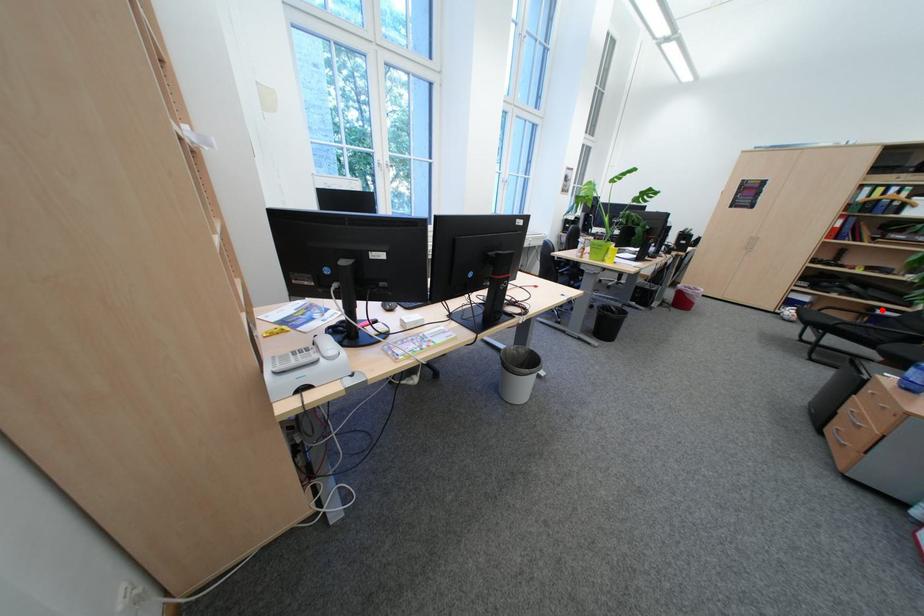
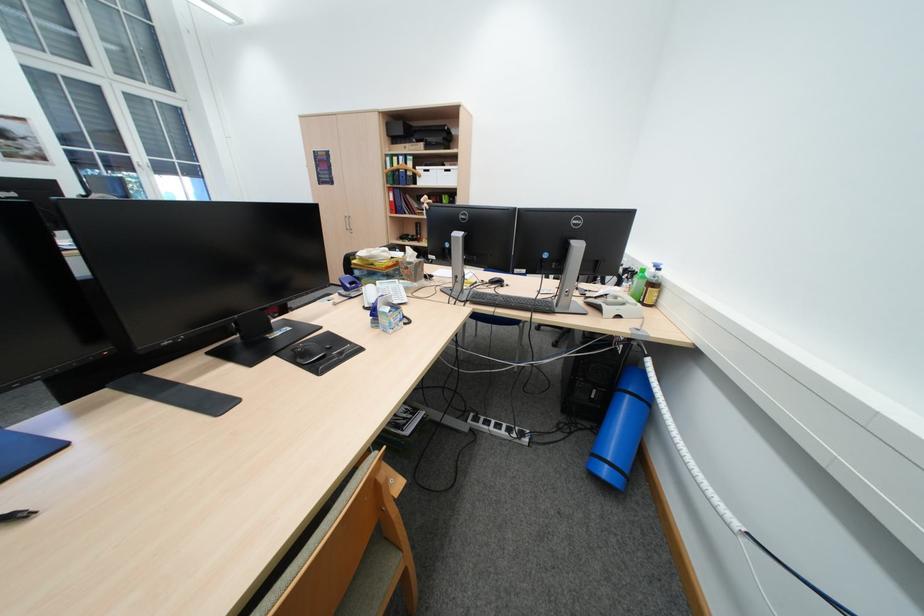
Question: I am providing you with two images of the same scene from different viewpoints. A red point is marked on the first image. Can you still see the location of the red point in image 2?

Choices:
 (A) Yes
 (B) No

Answer: (B)